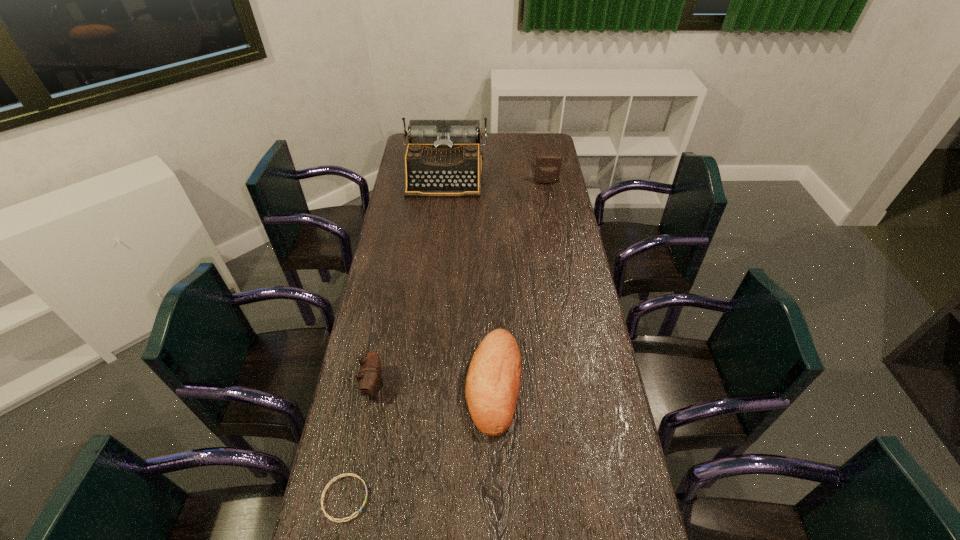
At what (x,y) coordinates should I click in order to perform the action: click on typewriter. Please return your answer as a coordinate pair (x, y). Image resolution: width=960 pixels, height=540 pixels. Looking at the image, I should click on (443, 158).

In order to click on the second tallest object in this screenshot , I will do `click(548, 166)`.

Find the location of a particular element. the rightmost object is located at coordinates (548, 166).

I want to click on the left pouch, so click(x=369, y=379).

Where is `the shorter pouch`? The image size is (960, 540). the shorter pouch is located at coordinates (369, 379).

You are a GUI agent. You are given a task and a screenshot of the screen. Output one action in this format:
    pyautogui.click(x=<x>, y=<y>)
    Task: Click on the second shortest object
    Image resolution: width=960 pixels, height=540 pixels.
    Given the screenshot: What is the action you would take?
    pyautogui.click(x=493, y=381)

Locate an element on the screen. This screenshot has height=540, width=960. the shortest object is located at coordinates (348, 474).

You are a GUI agent. You are given a task and a screenshot of the screen. Output one action in this format:
    pyautogui.click(x=<x>, y=<y>)
    Task: Click on the nearest object
    
    Given the screenshot: What is the action you would take?
    pyautogui.click(x=348, y=474)

This screenshot has height=540, width=960. What are the coordinates of `vacant space located 0.180m on the keyboard of the tallest object` in the screenshot? It's located at click(440, 223).

Locate an element on the screen. vacant space located 0.080m with an open flap on the farther pouch is located at coordinates (549, 195).